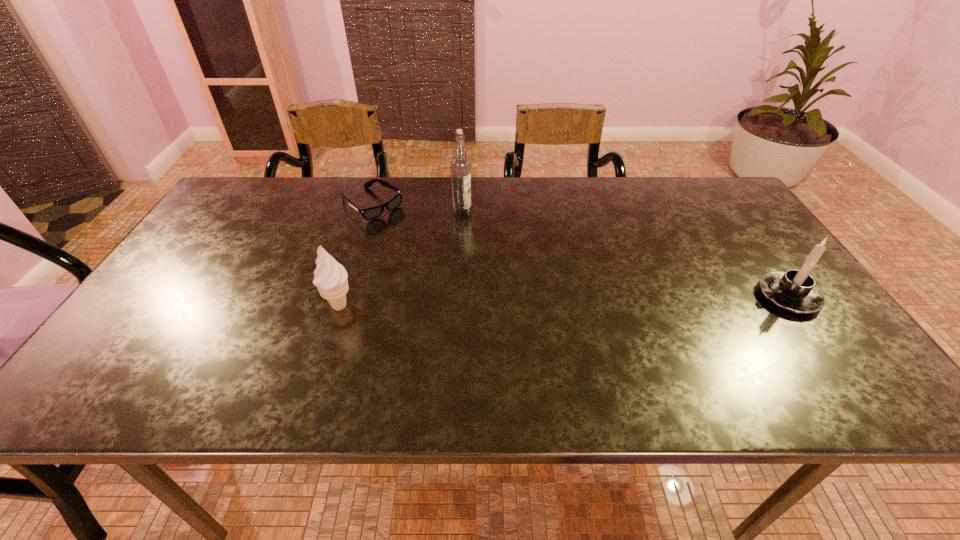
Identify the location of vacant area at the left edge. The image size is (960, 540). (175, 269).

Locate an element on the screen. This screenshot has width=960, height=540. vacant area at the right edge of the desktop is located at coordinates (783, 328).

Where is `vacant space at the far left corner`? Image resolution: width=960 pixels, height=540 pixels. vacant space at the far left corner is located at coordinates (236, 199).

You are a GUI agent. You are given a task and a screenshot of the screen. Output one action in this format:
    pyautogui.click(x=<x>, y=<y>)
    Task: Click on the vacant point located between the candle holder and the icecream
    This screenshot has width=960, height=540.
    Given the screenshot: What is the action you would take?
    pyautogui.click(x=564, y=301)

Identify the location of free spot between the icecream and the rightmost object. This screenshot has height=540, width=960. (564, 301).

You are a GUI agent. You are given a task and a screenshot of the screen. Output one action in this format:
    pyautogui.click(x=<x>, y=<y>)
    Task: Click on the vacant space that's between the icecream and the tallest object
    This screenshot has height=540, width=960.
    Given the screenshot: What is the action you would take?
    pyautogui.click(x=400, y=259)

The height and width of the screenshot is (540, 960). I want to click on vacant space that is in between the shortest object and the rightmost object, so click(580, 251).

Where is `free space that is in between the sunglasses and the candle holder`? Image resolution: width=960 pixels, height=540 pixels. free space that is in between the sunglasses and the candle holder is located at coordinates (580, 251).

Where is `empty location between the candle holder and the sunglasses`? empty location between the candle holder and the sunglasses is located at coordinates (580, 251).

The width and height of the screenshot is (960, 540). Identify the location of free area in between the icecream and the rightmost object. (564, 301).